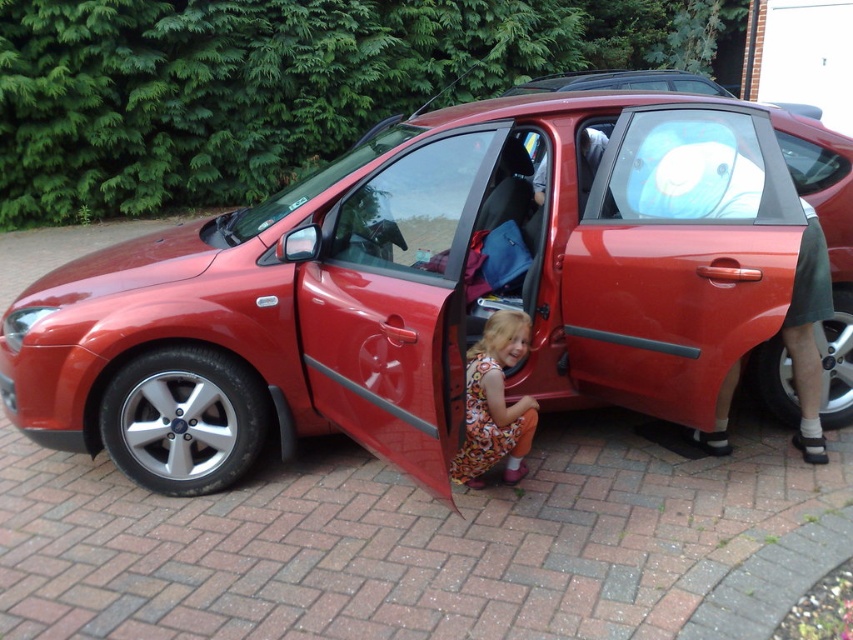
Question: Is glossy red car at center below floral dress at lower center?

Choices:
 (A) yes
 (B) no

Answer: (B)

Question: Which of the following is the closest to the observer?

Choices:
 (A) matte red minivan at center
 (B) floral dress at lower center

Answer: (B)

Question: Which point is farther to the camera?

Choices:
 (A) (711, 348)
 (B) (492, 380)
 (C) (848, 205)

Answer: (C)

Question: Is glossy red car at center to the right of matte red minivan at center from the viewer's perspective?

Choices:
 (A) no
 (B) yes

Answer: (A)

Question: Can you confirm if glossy red car at center is thinner than floral dress at lower center?

Choices:
 (A) no
 (B) yes

Answer: (A)

Question: Which point is farther to the camera?

Choices:
 (A) floral dress at lower center
 (B) glossy red car at center
 (C) matte red minivan at center

Answer: (C)